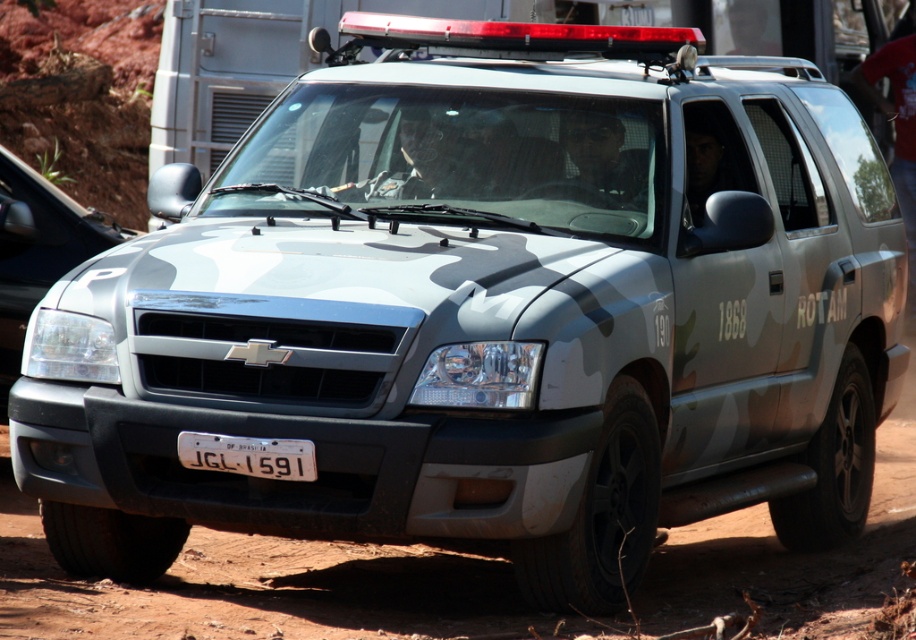
Question: Does matte gray headlight at center come behind white plastic license plate at center?

Choices:
 (A) yes
 (B) no

Answer: (A)

Question: Where is matte gray headlight at center located in relation to white plastic license plate at center in the image?

Choices:
 (A) below
 (B) above

Answer: (B)

Question: Is matte gray headlight at center bigger than white plastic license plate at center?

Choices:
 (A) no
 (B) yes

Answer: (B)